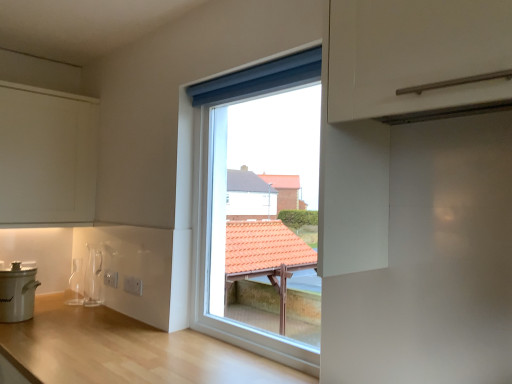
Question: From the image's perspective, is white matte cooker at lower left on light wood countertop at center?

Choices:
 (A) no
 (B) yes

Answer: (B)

Question: Considering the relative positions of white matte cooker at lower left and light wood countertop at center in the image provided, is white matte cooker at lower left in front of light wood countertop at center?

Choices:
 (A) yes
 (B) no

Answer: (B)

Question: Considering the relative positions of white matte cooker at lower left and light wood countertop at center in the image provided, is white matte cooker at lower left to the left of light wood countertop at center from the viewer's perspective?

Choices:
 (A) yes
 (B) no

Answer: (A)

Question: From a real-world perspective, is white matte cooker at lower left positioned over light wood countertop at center based on gravity?

Choices:
 (A) no
 (B) yes

Answer: (B)

Question: Can you confirm if white matte cooker at lower left is bigger than light wood countertop at center?

Choices:
 (A) yes
 (B) no

Answer: (B)

Question: Could you tell me if white matte cooker at lower left is turned towards light wood countertop at center?

Choices:
 (A) no
 (B) yes

Answer: (A)

Question: From a real-world perspective, is white matte cabinet at upper left positioned under white plastic window at center based on gravity?

Choices:
 (A) no
 (B) yes

Answer: (A)

Question: Is white matte cabinet at upper left far away from white plastic window at center?

Choices:
 (A) no
 (B) yes

Answer: (B)

Question: Considering the relative positions of white matte cabinet at upper left and white plastic window at center in the image provided, is white matte cabinet at upper left to the left of white plastic window at center from the viewer's perspective?

Choices:
 (A) yes
 (B) no

Answer: (A)

Question: Considering the relative positions of white matte cabinet at upper left and white plastic window at center in the image provided, is white matte cabinet at upper left in front of white plastic window at center?

Choices:
 (A) no
 (B) yes

Answer: (A)

Question: From the image's perspective, does white matte cabinet at upper left appear higher than white plastic window at center?

Choices:
 (A) no
 (B) yes

Answer: (B)

Question: Is the depth of white matte cabinet at upper left greater than that of white plastic window at center?

Choices:
 (A) no
 (B) yes

Answer: (B)

Question: Does white matte cooker at lower left have a greater width compared to white matte cabinet at upper left?

Choices:
 (A) yes
 (B) no

Answer: (B)